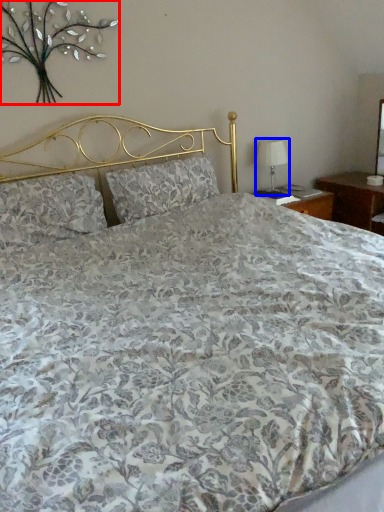
Question: Which point is closer to the camera, floral arrangement (highlighted by a red box) or table lamp (highlighted by a blue box)?

Choices:
 (A) floral arrangement
 (B) table lamp

Answer: (A)